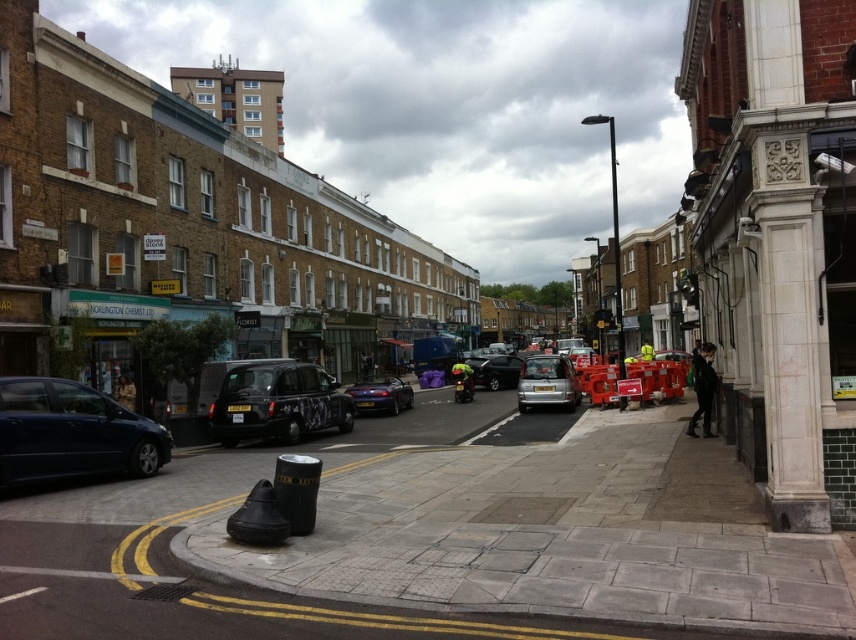
Which of these two, black matte taxi at center or glossy metallic car at center, stands shorter?

glossy metallic car at center is shorter.

Can you confirm if black matte taxi at center is positioned above glossy metallic car at center?

Yes, black matte taxi at center is above glossy metallic car at center.

Locate an element on the screen. The height and width of the screenshot is (640, 856). black matte taxi at center is located at coordinates (277, 403).

Which is in front, point (110, 460) or point (539, 372)?

Point (110, 460) is more forward.

Between shiny dark blue sedan at lower left and silver metallic van at center, which one is positioned higher?

silver metallic van at center is above.

At what (x,y) coordinates should I click in order to perform the action: click on shiny dark blue sedan at lower left. Please return your answer as a coordinate pair (x, y). Looking at the image, I should click on (72, 433).

Find the location of a particular element. The image size is (856, 640). shiny dark blue sedan at lower left is located at coordinates (72, 433).

Is point (328, 387) closer to viewer compared to point (551, 385)?

That is True.

Does black matte taxi at center have a larger size compared to silver metallic van at center?

Actually, black matte taxi at center might be smaller than silver metallic van at center.

Where is `black matte taxi at center`? This screenshot has height=640, width=856. black matte taxi at center is located at coordinates (277, 403).

The height and width of the screenshot is (640, 856). What are the coordinates of `black matte taxi at center` in the screenshot? It's located at (277, 403).